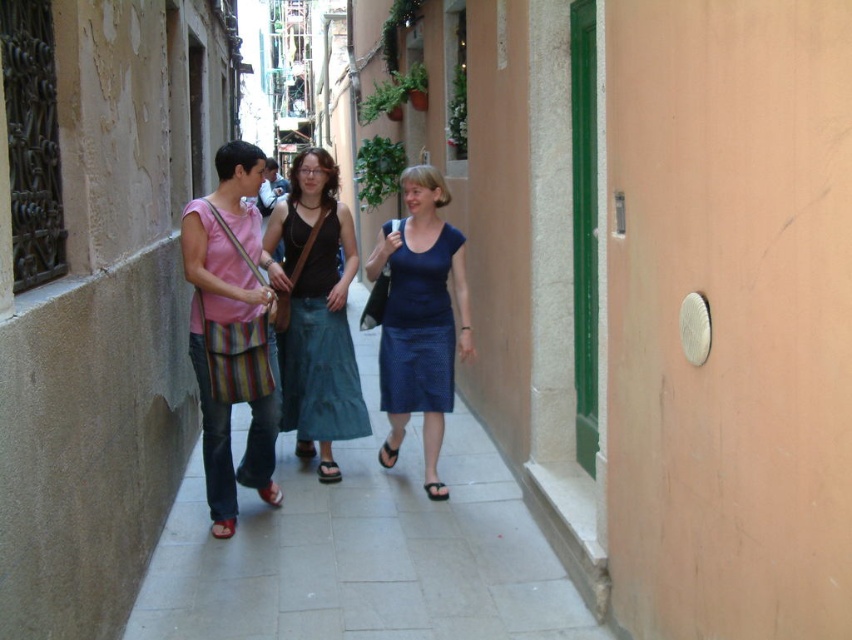
Question: Among these points, which one is nearest to the camera?

Choices:
 (A) (381, 452)
 (B) (419, 328)

Answer: (B)

Question: Does gray concrete pavement at center have a larger size compared to red leather sandal at lower left?

Choices:
 (A) no
 (B) yes

Answer: (B)

Question: Which object appears closest to the camera in this image?

Choices:
 (A) matte pink sandal at lower center
 (B) blue fabric skirt at center
 (C) red leather sandal at lower left
 (D) brown leather sandal at center

Answer: (C)

Question: Is gray concrete pavement at center wider than brown leather sandal at center?

Choices:
 (A) yes
 (B) no

Answer: (A)

Question: Which of the following is the closest to the observer?

Choices:
 (A) leather sandal at center
 (B) gray concrete pavement at center

Answer: (B)

Question: Does matte black tank top at center have a greater width compared to red leather sandal at lower left?

Choices:
 (A) yes
 (B) no

Answer: (A)